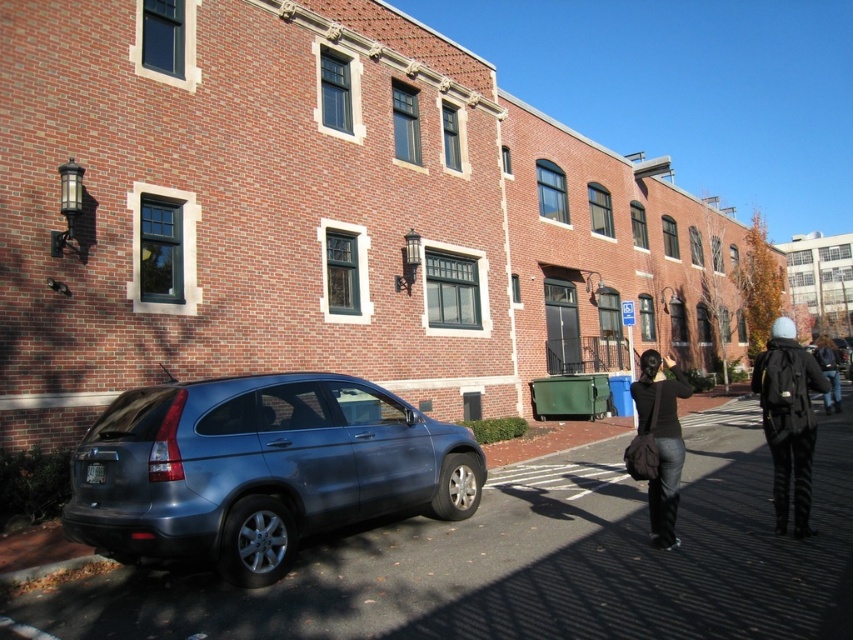
You are standing at the center of the image and want to walk to the metallic gray car at lower left. Which direction should you move in?

You should move to the lower left direction to reach the metallic gray car at lower left.

You are a delivery person who needs to place a small package on the ground near the parked blue SUV. The package must be placed between the white woolen hat at right and the dark brown leather bag at lower right. Which object should you place it closer to to ensure it fits within the available space?

The dark brown leather bag at lower right is smaller than the white woolen hat at right, so placing the package closer to the dark brown leather bag at lower right would leave more space for the package to fit between them.

You are standing on the sidewalk in front of the brick building and see the metallic gray car at lower left and the white woolen hat at right. Which object is closer to the building?

The metallic gray car at lower left is closer to the building because it is positioned to the left of the white woolen hat at right, and since the car is parked in front of the building, its proximity is closer than the hat.